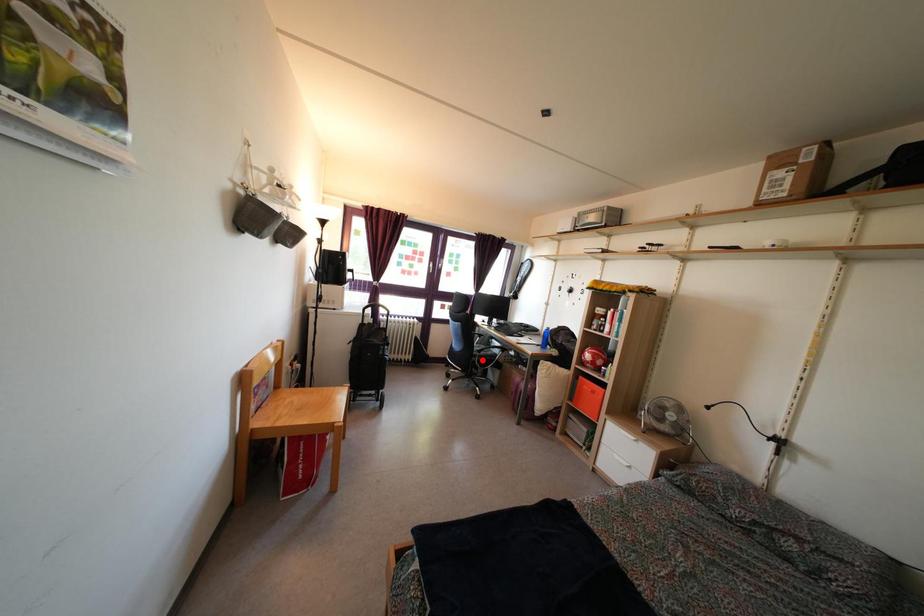
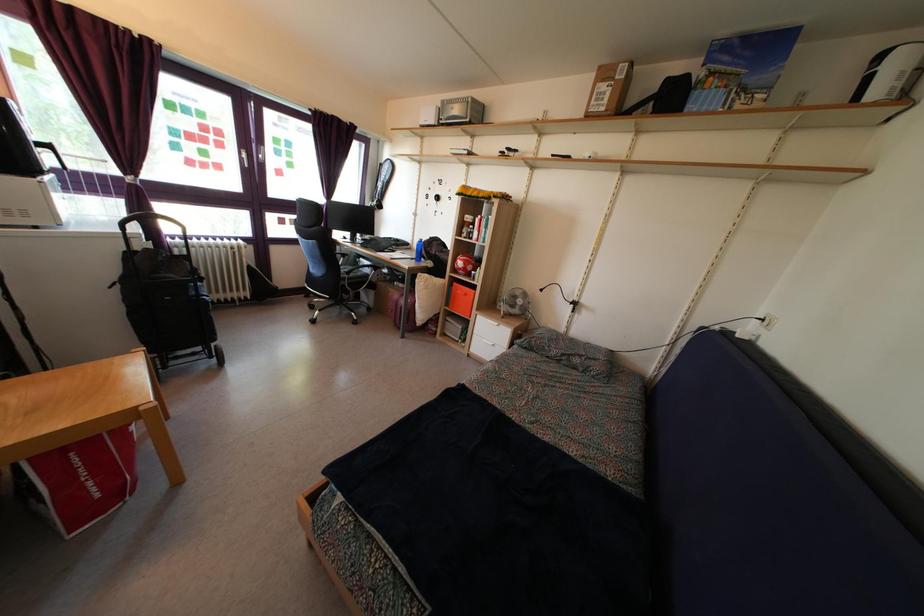
Where in the second image is the point corresponding to the highlighted location from the first image?

(350, 282)